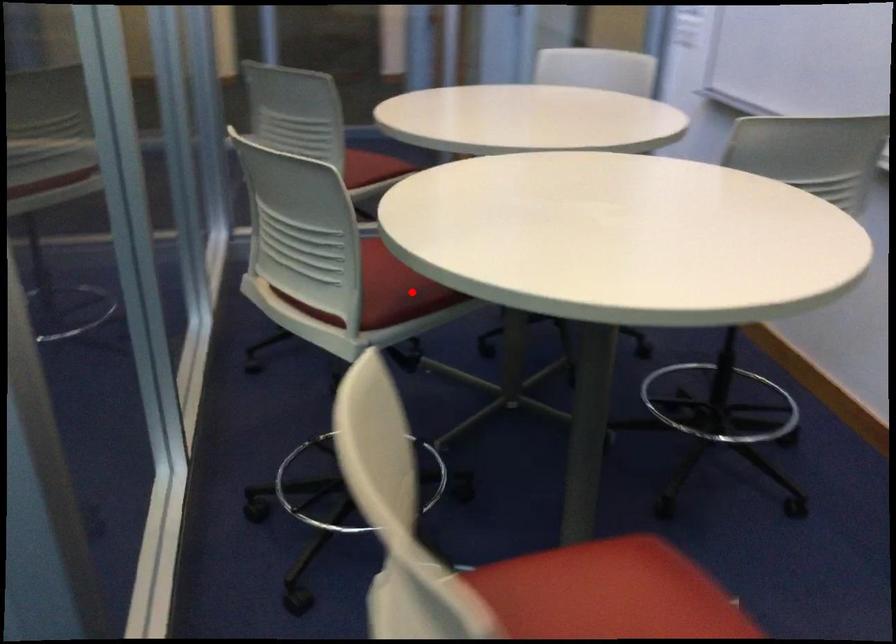
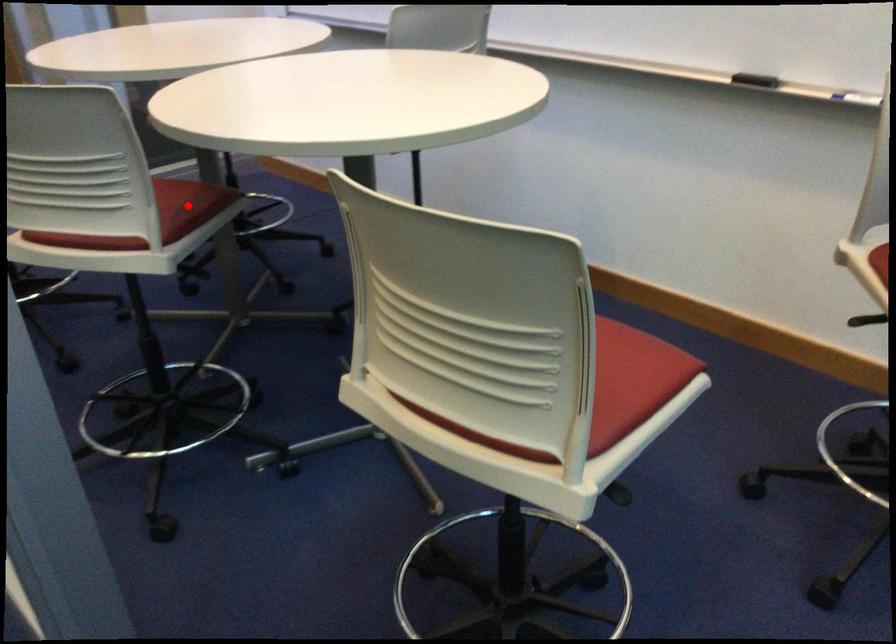
I am providing you with two images of the same scene from different viewpoints. A red point is marked on the first image and another point is marked on the second image. Do the highlighted points in image1 and image2 indicate the same real-world spot?

Yes